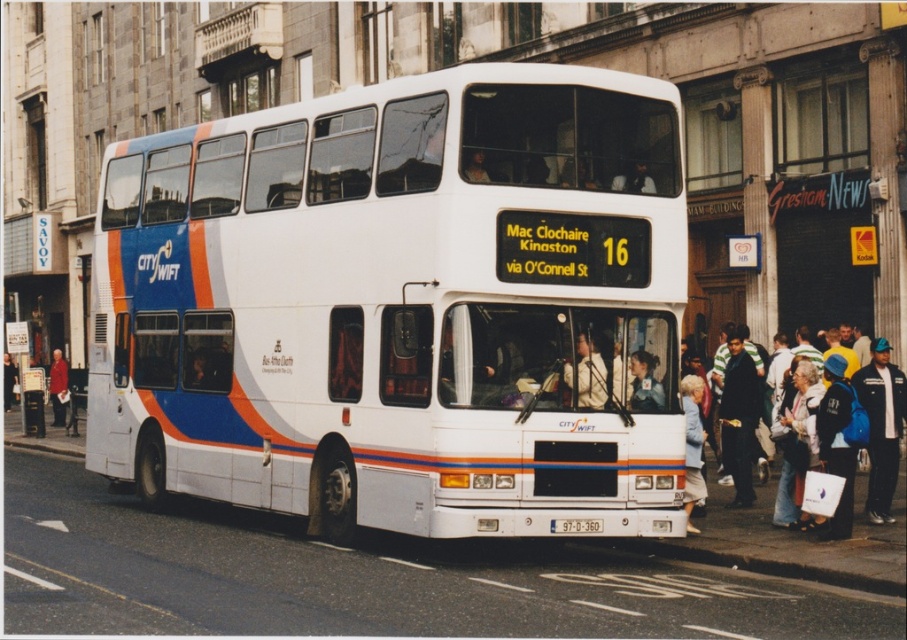
Is dark blue jacket at lower right smaller than white plastic license plate at center?

No.

Which is more to the right, dark blue jacket at lower right or white plastic license plate at center?

Positioned to the right is dark blue jacket at lower right.

Measure the distance between point (x=749, y=445) and camera.

Point (x=749, y=445) is 13.47 meters from camera.

Locate an element on the screen. Image resolution: width=907 pixels, height=640 pixels. dark blue jacket at lower right is located at coordinates click(739, 417).

The height and width of the screenshot is (640, 907). Describe the element at coordinates (739, 417) in the screenshot. I see `dark blue jacket at lower right` at that location.

Consider the image. Which is below, dark blue jacket at lower right or light beige fabric jacket at center?

dark blue jacket at lower right is below.

This screenshot has width=907, height=640. What are the coordinates of `dark blue jacket at lower right` in the screenshot? It's located at (739, 417).

Who is taller, white glossy decker bus at center or white plastic license plate at center?

white glossy decker bus at center is taller.

Can you confirm if white glossy decker bus at center is positioned below white plastic license plate at center?

Incorrect, white glossy decker bus at center is not positioned below white plastic license plate at center.

Who is more distant from viewer, (191, 179) or (587, 524)?

The point (191, 179) is behind.

Identify the location of white glossy decker bus at center. This screenshot has width=907, height=640. point(398,305).